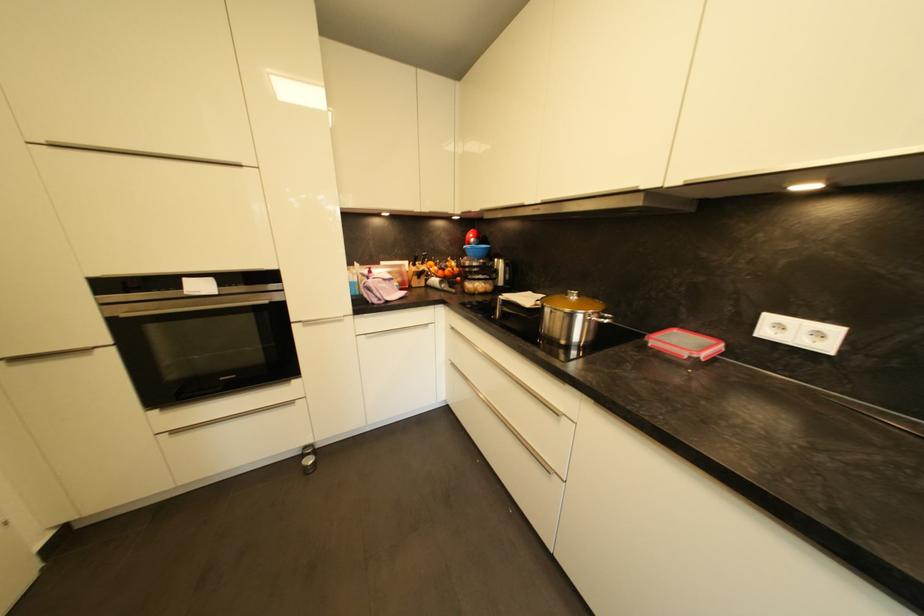
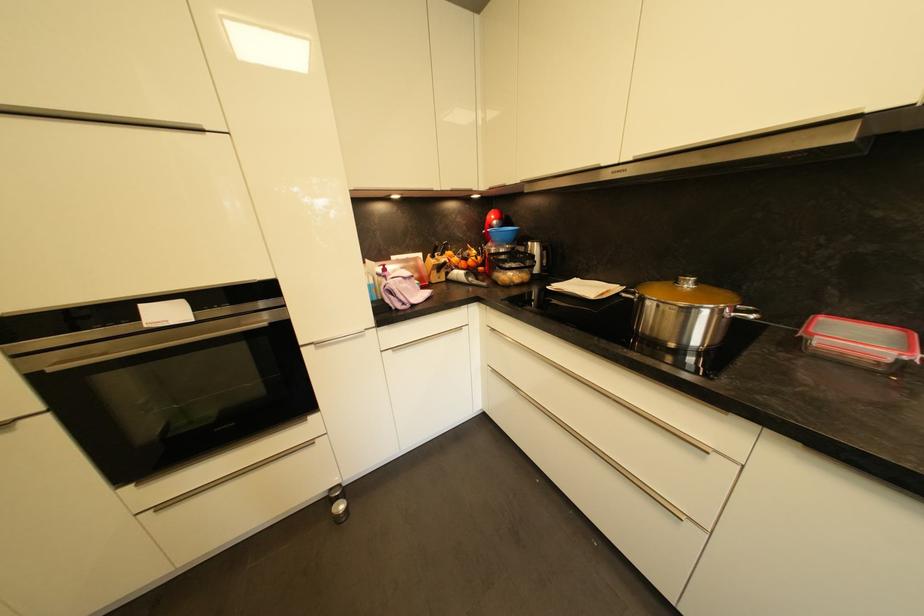
Find the pixel in the second image that matches (688,330) in the first image.

(836, 315)